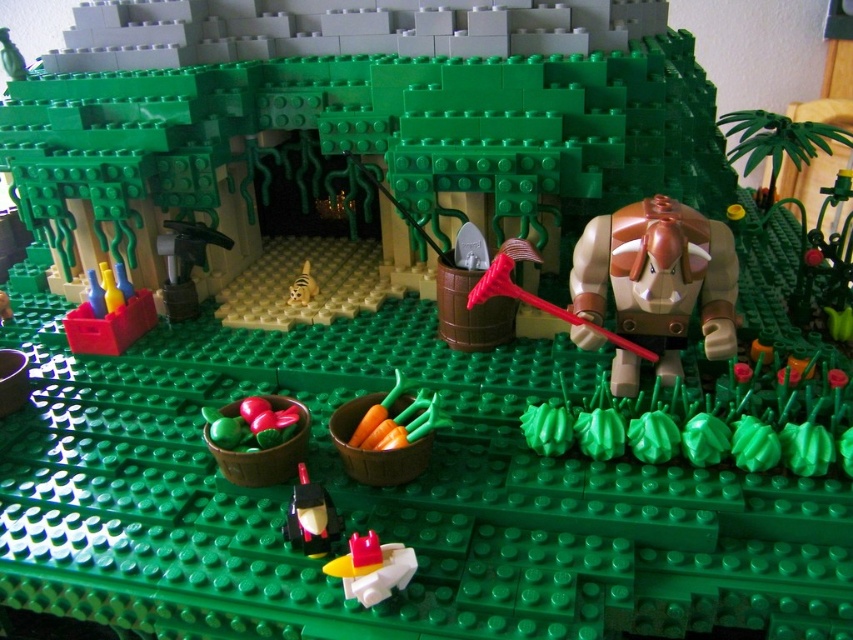
Does metallic gray hammer at center-left appear over shiny red car at lower center?

Indeed, metallic gray hammer at center-left is positioned over shiny red car at lower center.

Who is positioned more to the right, metallic gray hammer at center-left or shiny red car at lower center?

From the viewer's perspective, shiny red car at lower center appears more on the right side.

Describe the element at coordinates (184, 262) in the screenshot. I see `metallic gray hammer at center-left` at that location.

This screenshot has width=853, height=640. What are the coordinates of `metallic gray hammer at center-left` in the screenshot? It's located at (184, 262).

Can you confirm if translucent yellow plastic spaceship at center is thinner than metallic gray hammer at center-left?

Correct, translucent yellow plastic spaceship at center's width is less than metallic gray hammer at center-left's.

Which is in front, point (366, 538) or point (210, 228)?

Point (366, 538) is more forward.

Where is `translucent yellow plastic spaceship at center`? translucent yellow plastic spaceship at center is located at coordinates (372, 568).

Can you confirm if metallic gray hammer at center-left is wider than yellow plastic tiger at center?

Correct, the width of metallic gray hammer at center-left exceeds that of yellow plastic tiger at center.

How far apart are metallic gray hammer at center-left and yellow plastic tiger at center?

metallic gray hammer at center-left is 20.62 centimeters from yellow plastic tiger at center.

At what (x,y) coordinates should I click in order to perform the action: click on metallic gray hammer at center-left. Please return your answer as a coordinate pair (x, y). Image resolution: width=853 pixels, height=640 pixels. Looking at the image, I should click on (184, 262).